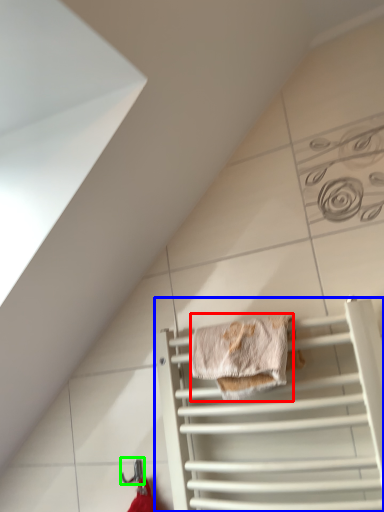
Question: Which object is the closest to the material (highlighted by a red box)? Choose among these: cage (highlighted by a blue box) or hanger (highlighted by a green box).

Choices:
 (A) cage
 (B) hanger

Answer: (A)